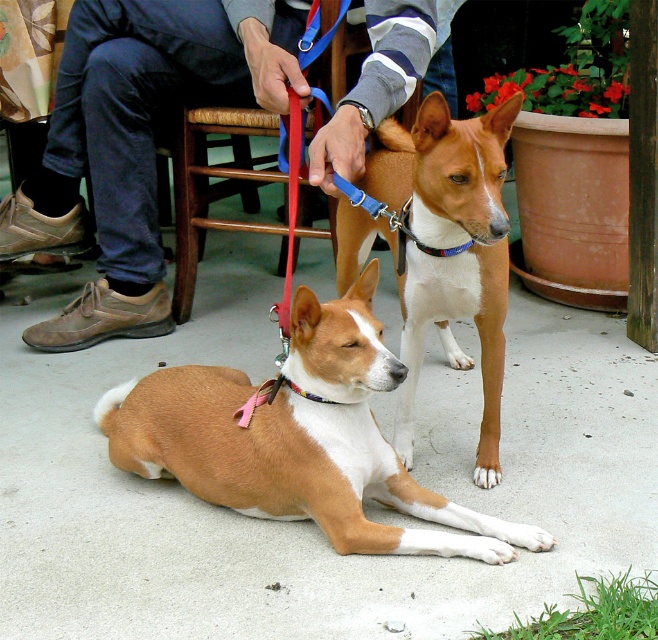
Question: Is brown/white fur dog at center below multicolored fabric neckband at center?

Choices:
 (A) no
 (B) yes

Answer: (A)

Question: Which object is closer to the camera taking this photo?

Choices:
 (A) brown/white fur dog at lower center
 (B) wooden chair at center
 (C) brown leather shoes at lower left
 (D) brown/white fur dog at center

Answer: (D)

Question: Based on their relative distances, which object is nearer to the multicolored fabric neckband at center?

Choices:
 (A) brown leather shoes at lower left
 (B) brown/white fur dog at center

Answer: (B)

Question: Is brown leather shoes at lower left bigger than multicolored fabric neckband at center?

Choices:
 (A) yes
 (B) no

Answer: (A)

Question: Is brown leather shoes at lower left bigger than brown/white fur dog at center?

Choices:
 (A) no
 (B) yes

Answer: (B)

Question: Which object is closer to the camera taking this photo?

Choices:
 (A) brown/white fur dog at center
 (B) wooden chair at center

Answer: (A)